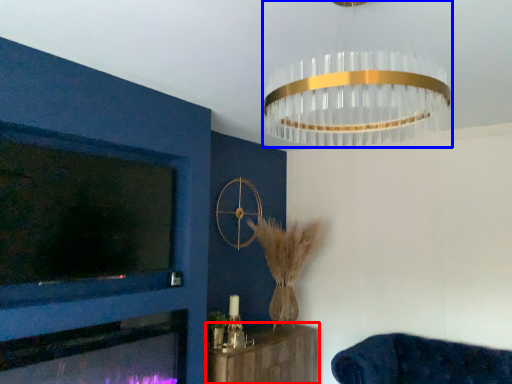
Question: Which object is closer to the camera taking this photo, furniture (highlighted by a red box) or lamp (highlighted by a blue box)?

Choices:
 (A) furniture
 (B) lamp

Answer: (B)